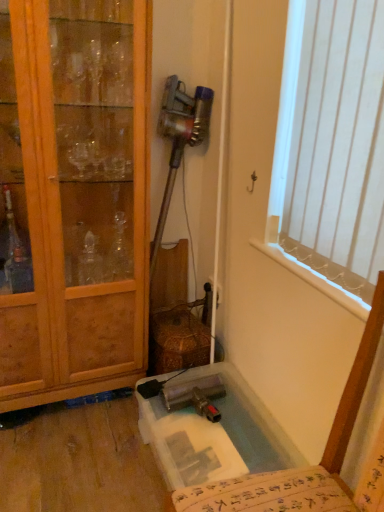
Question: Does wooden cabinet at left have a smaller size compared to translucent plastic chair at lower right?

Choices:
 (A) no
 (B) yes

Answer: (A)

Question: From the image's perspective, is wooden cabinet at left located beneath translucent plastic chair at lower right?

Choices:
 (A) yes
 (B) no

Answer: (B)

Question: Would you say wooden cabinet at left is outside translucent plastic chair at lower right?

Choices:
 (A) no
 (B) yes

Answer: (B)

Question: Does wooden cabinet at left touch translucent plastic chair at lower right?

Choices:
 (A) no
 (B) yes

Answer: (A)

Question: Does wooden cabinet at left have a larger size compared to translucent plastic chair at lower right?

Choices:
 (A) yes
 (B) no

Answer: (A)

Question: Is wooden cabinet at left thinner than translucent plastic chair at lower right?

Choices:
 (A) yes
 (B) no

Answer: (A)

Question: From the image's perspective, is wooden cabinet at left located beneath clear plastic bath at lower center?

Choices:
 (A) yes
 (B) no

Answer: (B)

Question: Is wooden cabinet at left at the right side of clear plastic bath at lower center?

Choices:
 (A) yes
 (B) no

Answer: (B)

Question: Does wooden cabinet at left have a smaller size compared to clear plastic bath at lower center?

Choices:
 (A) no
 (B) yes

Answer: (A)

Question: Could you tell me if wooden cabinet at left is facing clear plastic bath at lower center?

Choices:
 (A) yes
 (B) no

Answer: (B)

Question: Is wooden cabinet at left positioned before clear plastic bath at lower center?

Choices:
 (A) no
 (B) yes

Answer: (B)

Question: Is wooden cabinet at left located outside clear plastic bath at lower center?

Choices:
 (A) yes
 (B) no

Answer: (A)

Question: Considering the relative sizes of wooden cabinet at left and white vertical blinds at upper right in the image provided, is wooden cabinet at left smaller than white vertical blinds at upper right?

Choices:
 (A) no
 (B) yes

Answer: (A)